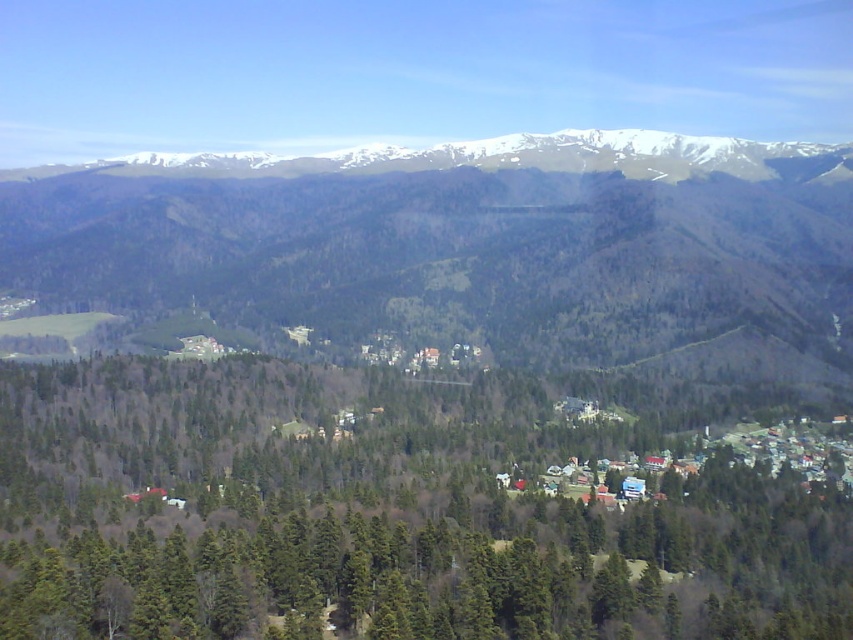
You are standing at the point labeled point (718, 627) and want to walk towards the point labeled point (135, 202). Which direction should you face to move towards it?

Since point (718, 627) is closer to the camera than point (135, 202), you should face downwards to move towards it.